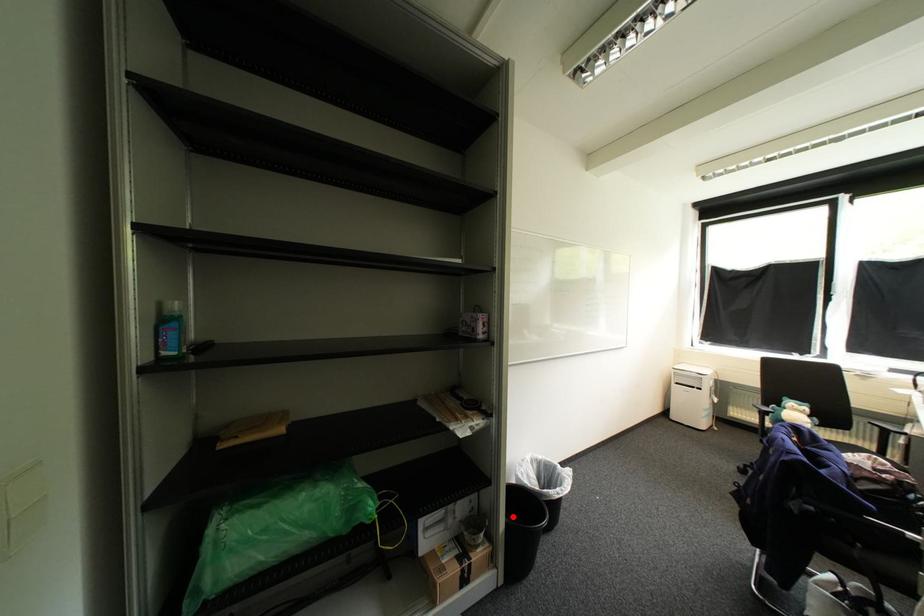
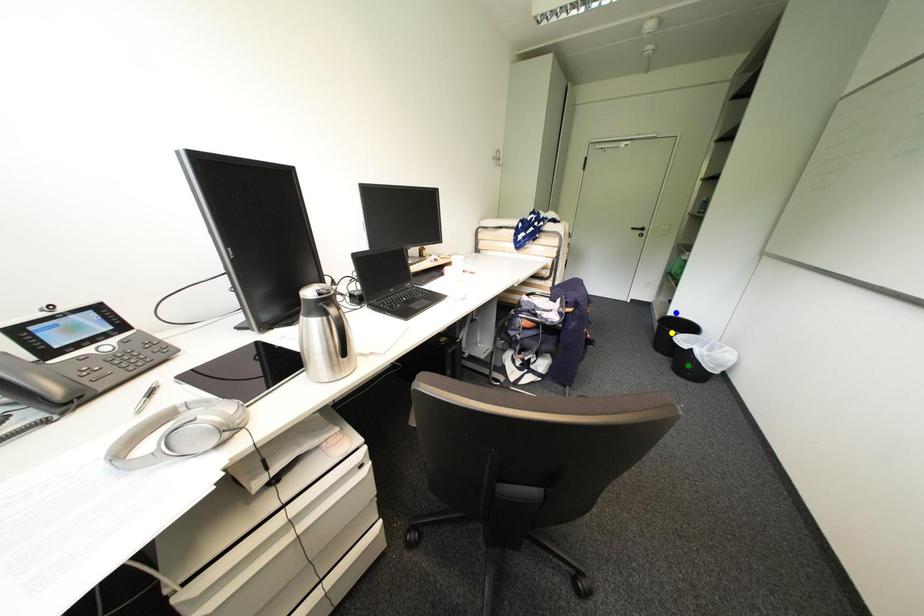
Question: I am providing you with two images of the same scene from different viewpoints. A red point is marked on the first image. You are given multiple points on the second image. Which point in image 2 is actually the same real-world point as the red point in image 1?

Choices:
 (A) blue point
 (B) green point
 (C) yellow point

Answer: (A)